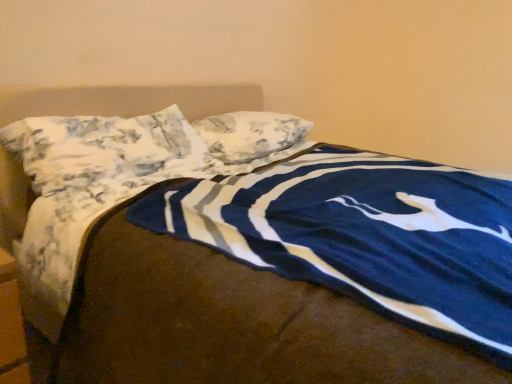
Question: From a real-world perspective, is floral fabric pillow at center, arranged as the 2th pillow when viewed from the front, physically located above or below floral fabric pillow at upper center, which is the first pillow in front-to-back order?

Choices:
 (A) below
 (B) above

Answer: (A)

Question: Is floral fabric pillow at center, arranged as the 2th pillow when viewed from the front, wider or thinner than floral fabric pillow at upper center, the second pillow viewed from the back?

Choices:
 (A) wide
 (B) thin

Answer: (B)

Question: Is floral fabric pillow at center, arranged as the 2th pillow when viewed from the front, taller or shorter than floral fabric pillow at upper center, the second pillow viewed from the back?

Choices:
 (A) tall
 (B) short

Answer: (B)

Question: In terms of size, does floral fabric pillow at upper center, which is the first pillow in front-to-back order, appear bigger or smaller than floral fabric pillow at center, the 1th pillow in the back-to-front sequence?

Choices:
 (A) big
 (B) small

Answer: (A)

Question: Based on their positions, is floral fabric pillow at upper center, which is the first pillow in front-to-back order, located to the left or right of floral fabric pillow at center, the 1th pillow in the back-to-front sequence?

Choices:
 (A) right
 (B) left

Answer: (B)

Question: From a real-world perspective, relative to floral fabric pillow at center, the 1th pillow in the back-to-front sequence, is floral fabric pillow at upper center, which is the first pillow in front-to-back order, vertically above or below?

Choices:
 (A) below
 (B) above

Answer: (B)

Question: In the image, is floral fabric pillow at upper center, the second pillow viewed from the back, positioned in front of or behind floral fabric pillow at center, arranged as the 2th pillow when viewed from the front?

Choices:
 (A) front
 (B) behind

Answer: (A)